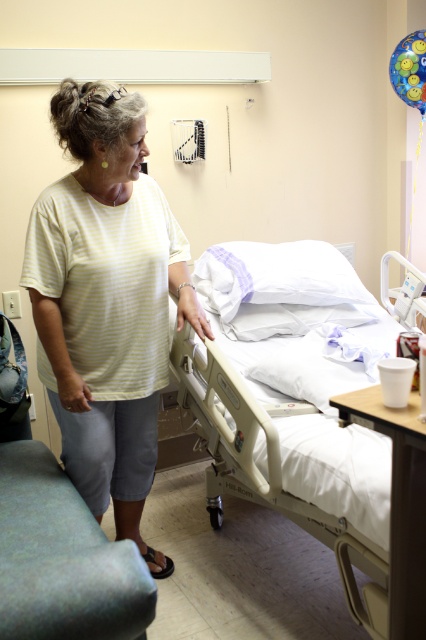
Question: Considering the relative positions of yellow striped shirt at center and beige plastic hospital bed at center in the image provided, where is yellow striped shirt at center located with respect to beige plastic hospital bed at center?

Choices:
 (A) right
 (B) left

Answer: (B)

Question: Which object appears farthest from the camera in this image?

Choices:
 (A) yellow striped shirt at center
 (B) beige plastic hospital bed at center

Answer: (A)

Question: Among these objects, which one is farthest from the camera?

Choices:
 (A) beige plastic hospital bed at center
 (B) yellow striped shirt at center

Answer: (B)

Question: From the image, what is the correct spatial relationship of yellow striped shirt at center in relation to beige plastic hospital bed at center?

Choices:
 (A) below
 (B) above

Answer: (B)

Question: Is yellow striped shirt at center below beige plastic hospital bed at center?

Choices:
 (A) no
 (B) yes

Answer: (A)